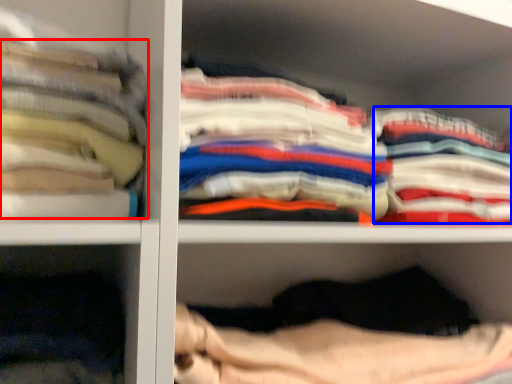
Question: Which of the following is the closest to the observer, clothing (highlighted by a red box) or clothing (highlighted by a blue box)?

Choices:
 (A) clothing
 (B) clothing

Answer: (A)